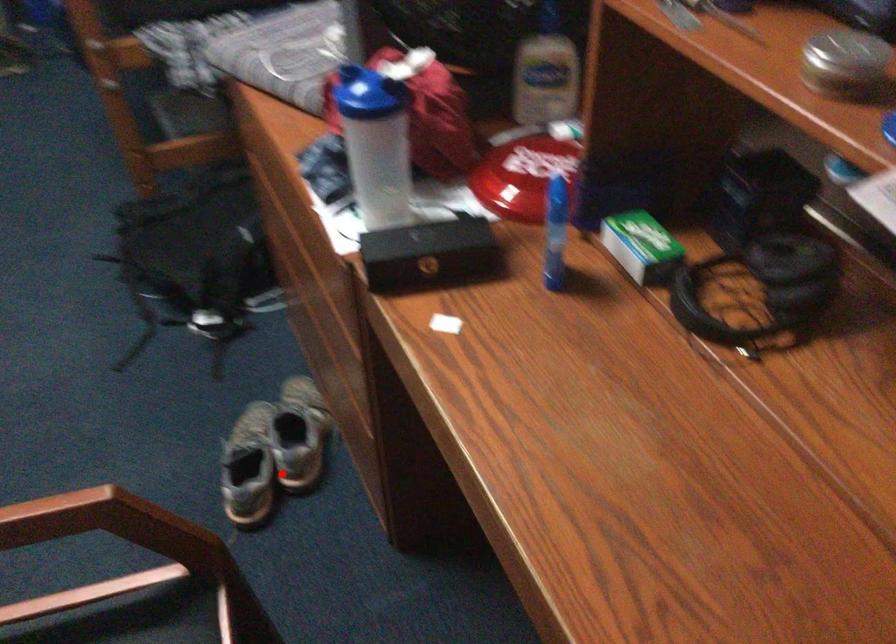
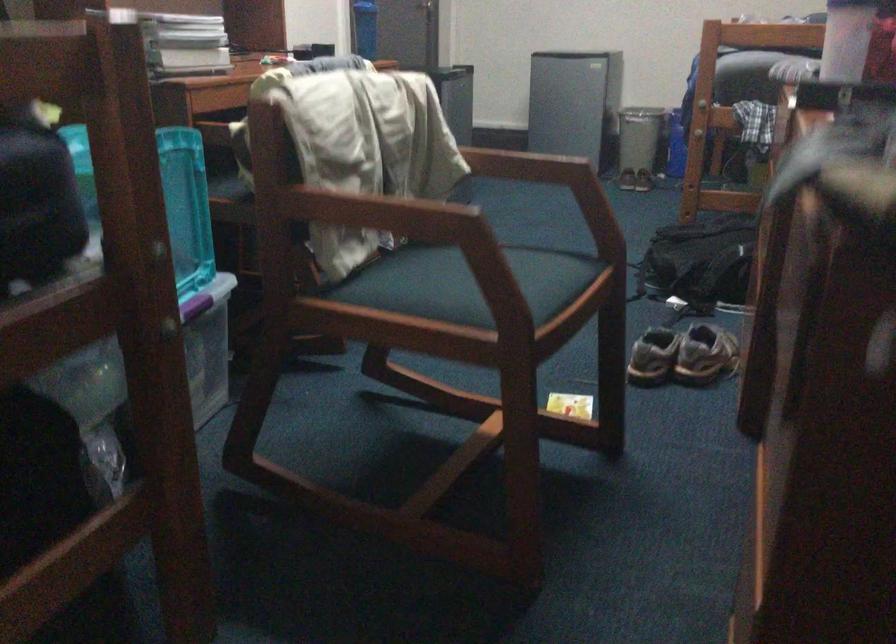
Where in the second image is the point corresponding to the highlighted location from the first image?

(682, 355)